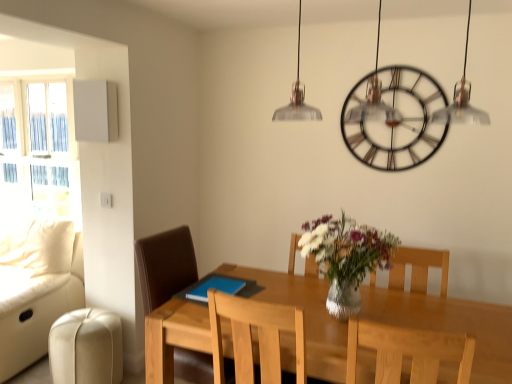
Question: Considering their positions, is brown leather chair at center, acting as the second chair starting from the front, located in front of or behind white glass window at left?

Choices:
 (A) behind
 (B) front

Answer: (B)

Question: From the image's perspective, is brown leather chair at center, acting as the second chair starting from the front, above or below white glass window at left?

Choices:
 (A) below
 (B) above

Answer: (A)

Question: Estimate the real-world distances between objects in this image. Which object is closer to the clear glass vase at center?

Choices:
 (A) leather couch at left
 (B) beige leather swivel chair at lower left
 (C) light wood chair at center, the 2th chair viewed from the left
 (D) white glass window at left
 (E) metallic/brass-toned clock at upper center

Answer: (C)

Question: Which object is positioned closest to the light wood table at center?

Choices:
 (A) light wood chair at center, which is the second chair from back to front
 (B) leather couch at left
 (C) clear glass vase at center
 (D) white glass window at left
 (E) brown leather chair at center, acting as the 1th chair starting from the back

Answer: (A)